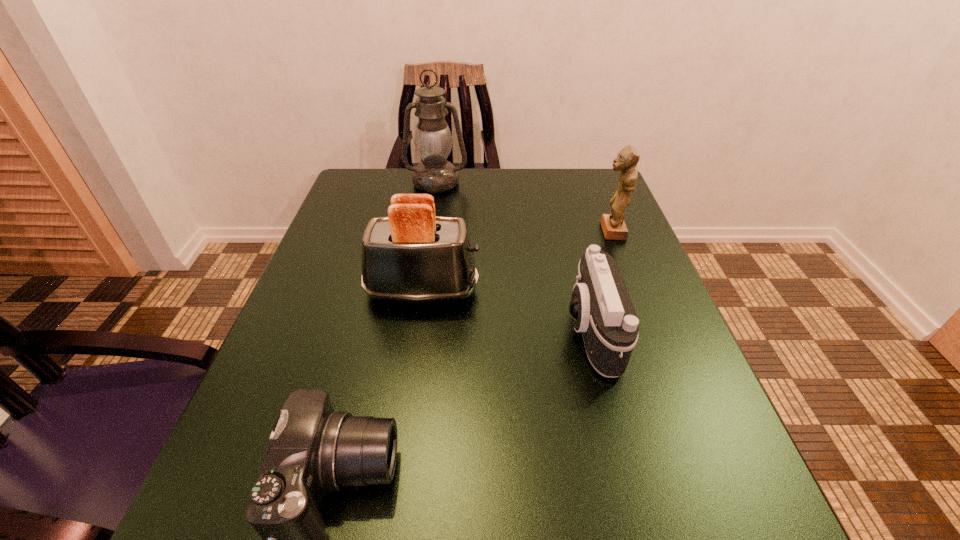
Where is `empty space that is in between the toaster and the rightmost object`? empty space that is in between the toaster and the rightmost object is located at coordinates (516, 261).

Point out which object is positioned as the fourth nearest to the tallest object. Please provide its 2D coordinates. Your answer should be formatted as a tuple, i.e. [(x, y)], where the tuple contains the x and y coordinates of a point satisfying the conditions above.

[(313, 450)]

Select which object appears as the closest to the farthest object. Please provide its 2D coordinates. Your answer should be formatted as a tuple, i.e. [(x, y)], where the tuple contains the x and y coordinates of a point satisfying the conditions above.

[(412, 255)]